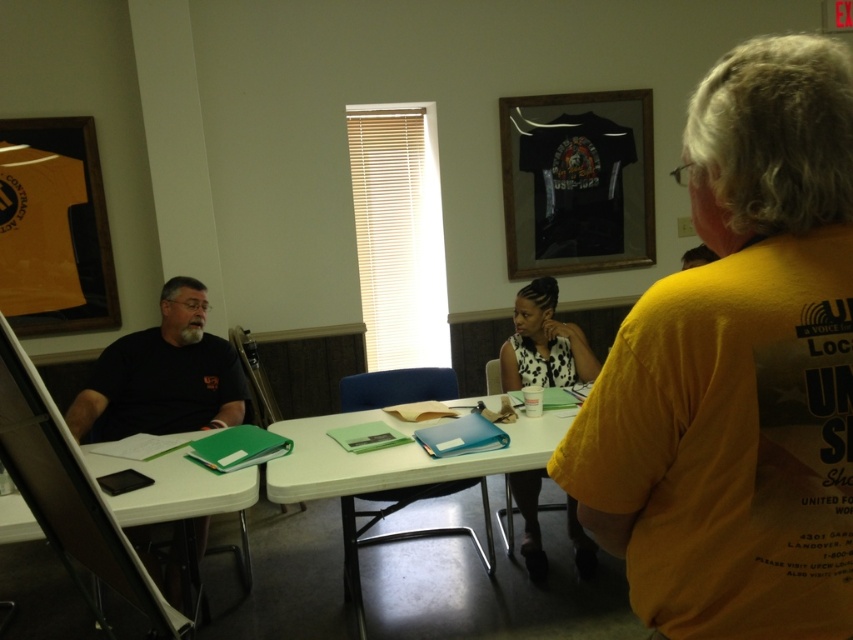
Question: Based on their relative distances, which object is farther from the white plastic table at center?

Choices:
 (A) green plastic folder at lower left
 (B) yellow t-shirt at right
 (C) black matte shirt at left

Answer: (B)

Question: Is white plastic table at center to the left of white dotted dress at center from the viewer's perspective?

Choices:
 (A) no
 (B) yes

Answer: (B)

Question: Among these objects, which one is nearest to the camera?

Choices:
 (A) white plastic table at center
 (B) green plastic folder at lower left

Answer: (B)

Question: Can you confirm if white plastic table at center is smaller than white dotted dress at center?

Choices:
 (A) yes
 (B) no

Answer: (B)

Question: Estimate the real-world distances between objects in this image. Which object is farther from the black matte shirt at left?

Choices:
 (A) green plastic folder at lower left
 (B) white dotted dress at center
 (C) white plastic table at center

Answer: (B)

Question: Observing the image, what is the correct spatial positioning of white plastic table at center in reference to white dotted dress at center?

Choices:
 (A) left
 (B) right

Answer: (A)